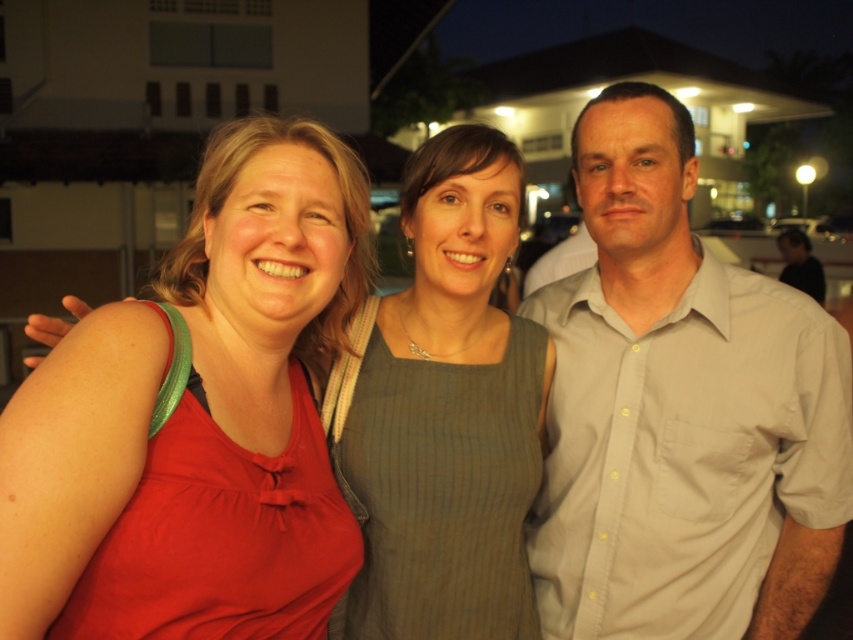
Question: Can you confirm if light gray button-up shirt at right is smaller than matte red tank top at left?

Choices:
 (A) yes
 (B) no

Answer: (B)

Question: Which point is farther to the camera?

Choices:
 (A) (793, 280)
 (B) (109, 588)
 (C) (703, 426)

Answer: (A)

Question: Can you confirm if light gray button-up shirt at right is positioned above light gray shirt at center?

Choices:
 (A) yes
 (B) no

Answer: (B)

Question: Where is light gray button-up shirt at right located in relation to light gray shirt at center in the image?

Choices:
 (A) right
 (B) left

Answer: (B)

Question: Which point is closer to the camera?

Choices:
 (A) (614, 518)
 (B) (254, 330)

Answer: (B)

Question: Which of the following is the farthest from the observer?

Choices:
 (A) (599, 230)
 (B) (801, 246)
 (C) (306, 614)

Answer: (B)